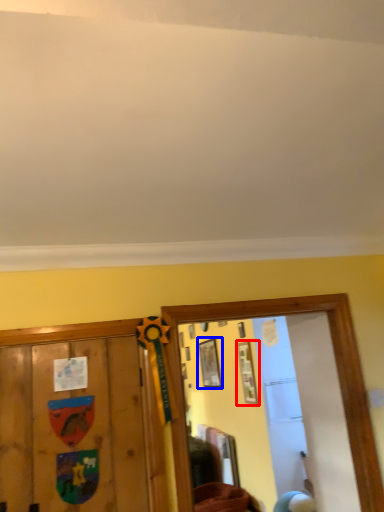
Question: Among these objects, which one is nearest to the camera, picture frame (highlighted by a red box) or picture frame (highlighted by a blue box)?

Choices:
 (A) picture frame
 (B) picture frame

Answer: (A)